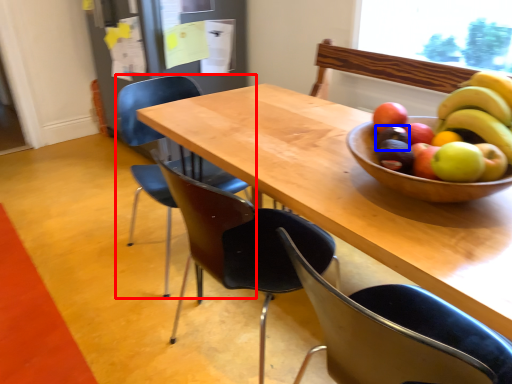
Question: Which object appears farthest to the camera in this image, chair (highlighted by a red box) or avocado (highlighted by a blue box)?

Choices:
 (A) chair
 (B) avocado

Answer: (A)